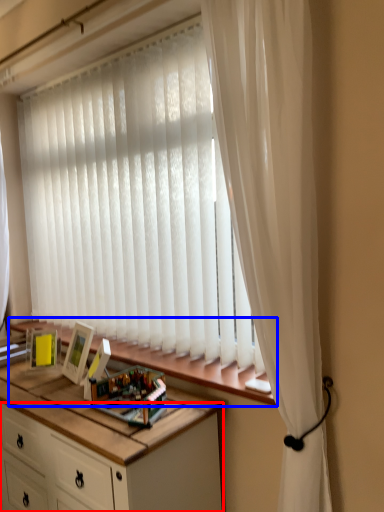
Question: Among these objects, which one is farthest to the camera, cabinetry (highlighted by a red box) or window sill (highlighted by a blue box)?

Choices:
 (A) cabinetry
 (B) window sill

Answer: (B)